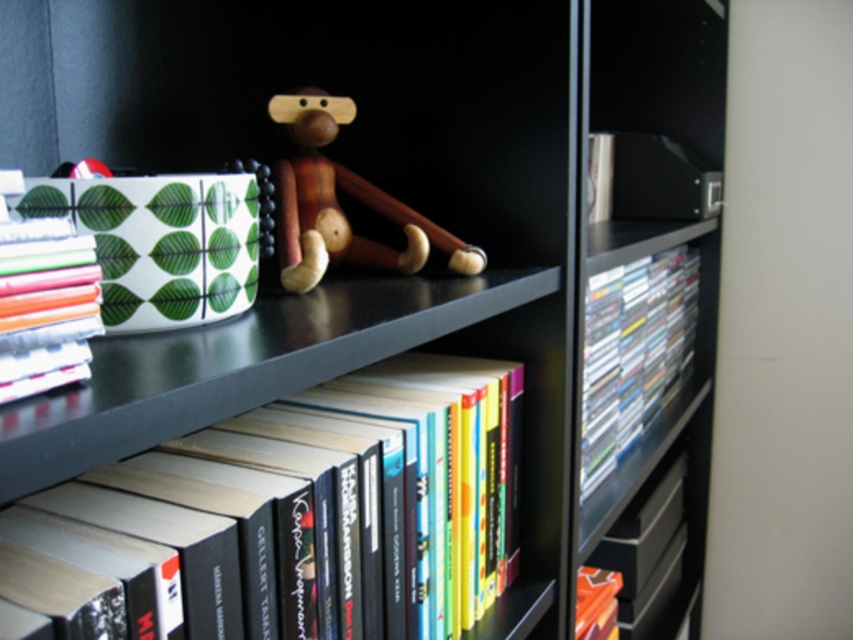
Question: Is white paper stack at left closer to camera compared to orange matte book at lower right?

Choices:
 (A) yes
 (B) no

Answer: (A)

Question: Which point is farther from the camera taking this photo?

Choices:
 (A) coord(604,579)
 (B) coord(13,173)

Answer: (A)

Question: Considering the relative positions of clear plastic dvds at right and white paper stack at left in the image provided, where is clear plastic dvds at right located with respect to white paper stack at left?

Choices:
 (A) right
 (B) left

Answer: (A)

Question: Is clear plastic dvds at right bigger than wooden monkey at center?

Choices:
 (A) no
 (B) yes

Answer: (B)

Question: Which point is farther to the camera?

Choices:
 (A) (4, 205)
 (B) (608, 605)
 (C) (672, 280)

Answer: (C)

Question: Which point is closer to the camera?

Choices:
 (A) (51, 298)
 (B) (369, 412)
 (C) (579, 596)
 (D) (619, 420)

Answer: (A)